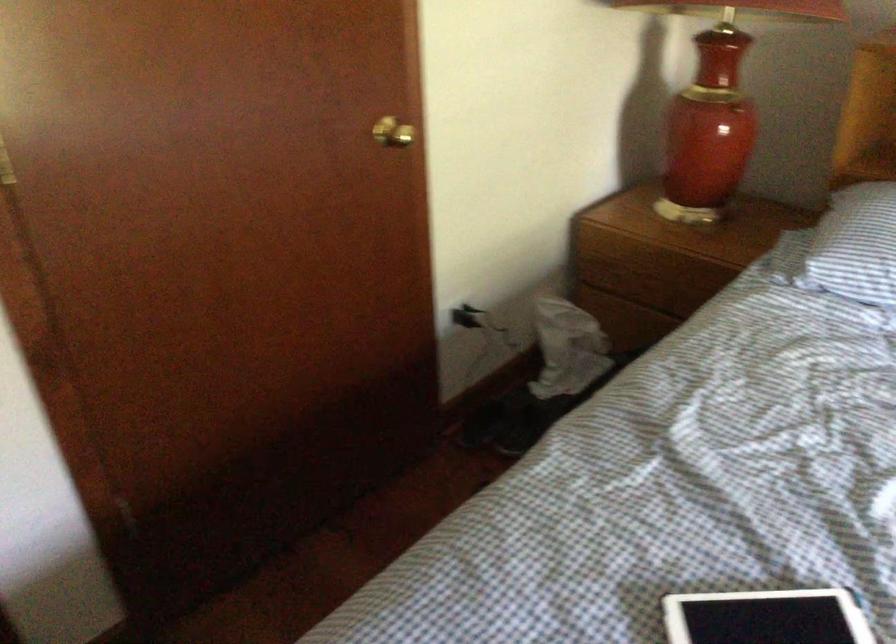
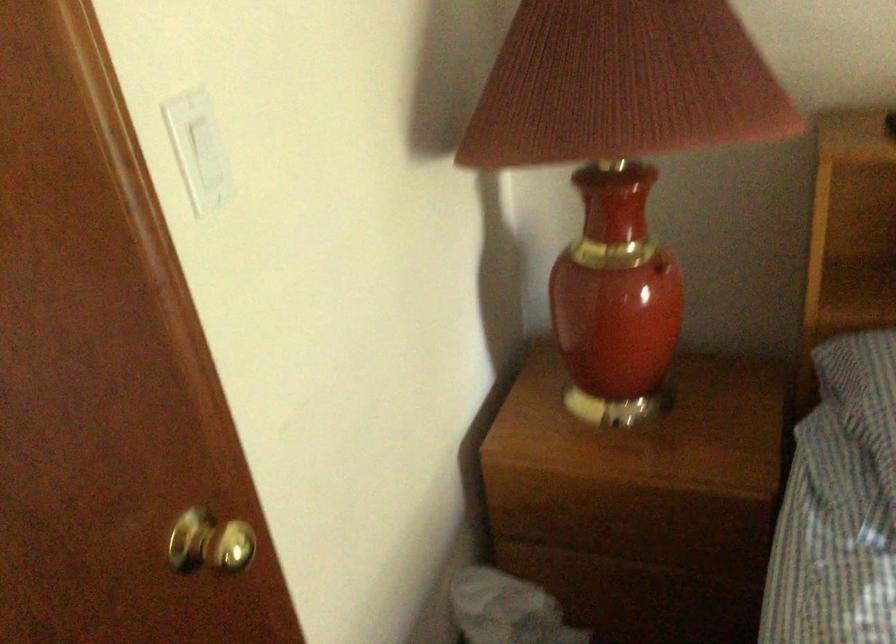
Locate, in the second image, the point that corresponds to point (734, 104) in the first image.

(661, 267)